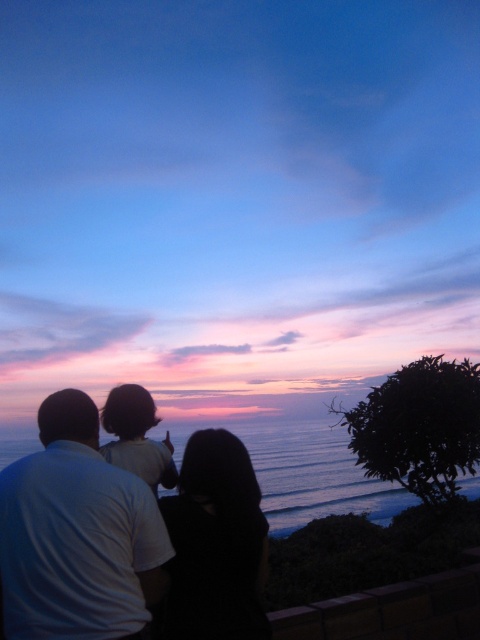
Can you confirm if white matte shirt at upper left is bigger than blue water at lower center?

No, white matte shirt at upper left is not bigger than blue water at lower center.

Which of these two, white matte shirt at upper left or blue water at lower center, stands shorter?

white matte shirt at upper left

Does point (90, 424) come in front of point (9, 436)?

Yes, it is in front of point (9, 436).

The height and width of the screenshot is (640, 480). What are the coordinates of `white matte shirt at upper left` in the screenshot? It's located at (76, 536).

Based on the photo, is white matte shirt at upper left shorter than black matte hair at center?

No.

Describe the element at coordinates (76, 536) in the screenshot. The width and height of the screenshot is (480, 640). I see `white matte shirt at upper left` at that location.

The width and height of the screenshot is (480, 640). I want to click on white matte shirt at upper left, so coord(76,536).

Is black matte hair at center bigger than dark hair at upper center?

Yes, black matte hair at center is bigger than dark hair at upper center.

Is black matte hair at center smaller than dark hair at upper center?

Actually, black matte hair at center might be larger than dark hair at upper center.

Is point (248, 611) closer to camera compared to point (157, 442)?

Yes, point (248, 611) is in front of point (157, 442).

The height and width of the screenshot is (640, 480). I want to click on black matte hair at center, so pos(215,544).